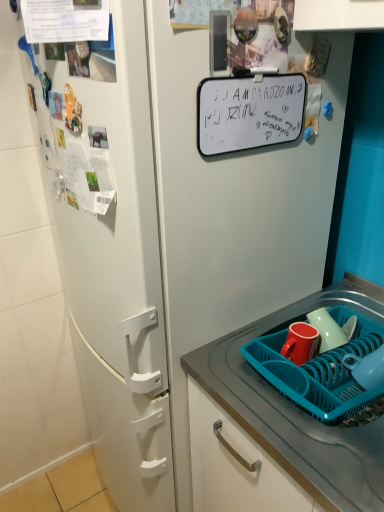
I want to click on free region on the left part of matte red mug at lower right, so click(245, 365).